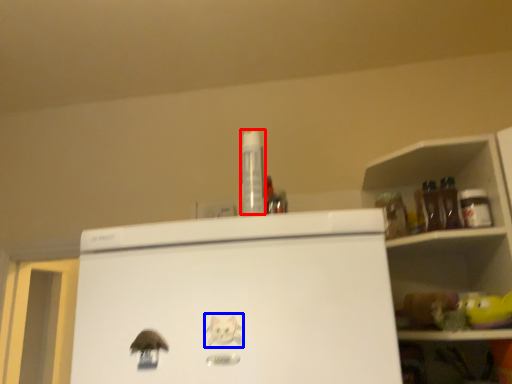
Question: Which of the following is the farthest to the observer, bottle (highlighted by a red box) or animal (highlighted by a blue box)?

Choices:
 (A) bottle
 (B) animal

Answer: (A)